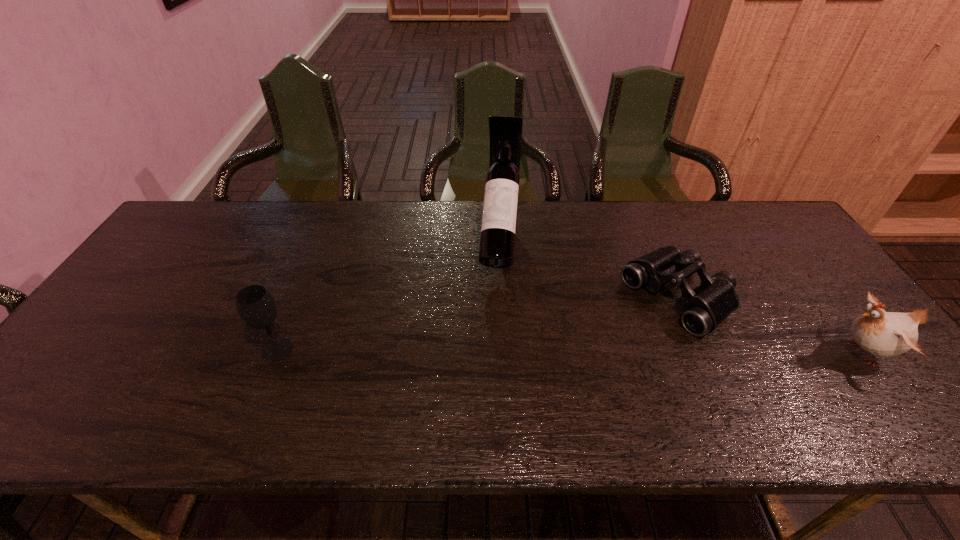
Where is `vacant spot on the desktop that is between the wineglass and the bird and is positioned on the stand of the third object from right to left`? The width and height of the screenshot is (960, 540). vacant spot on the desktop that is between the wineglass and the bird and is positioned on the stand of the third object from right to left is located at coordinates (487, 350).

Find the location of `vacant spot on the desktop that is between the leftmost object and the bird and is positioned on the front-facing side of the shortest object`. vacant spot on the desktop that is between the leftmost object and the bird and is positioned on the front-facing side of the shortest object is located at coordinates (597, 351).